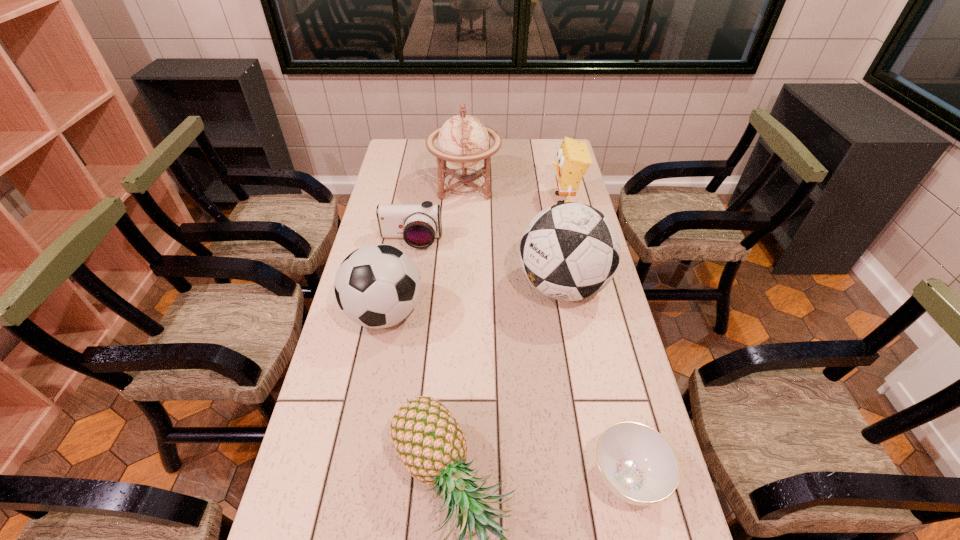
What are the coordinates of `soccer ball that is at the right edge` in the screenshot? It's located at (570, 251).

Identify the location of sponge positioned at the right edge. This screenshot has height=540, width=960. (573, 159).

Locate an element on the screen. chinaware that is at the right edge is located at coordinates (637, 464).

In the image, there is a desktop. Where is `free space at the far edge`? This screenshot has height=540, width=960. free space at the far edge is located at coordinates (500, 153).

The image size is (960, 540). Find the location of `free space at the left edge of the desktop`. free space at the left edge of the desktop is located at coordinates (310, 479).

At what (x,y) coordinates should I click in order to perform the action: click on free region at the right edge of the desktop. Please return your answer as a coordinate pair (x, y). The width and height of the screenshot is (960, 540). Looking at the image, I should click on (590, 354).

At what (x,y) coordinates should I click in order to perform the action: click on free region at the far left corner. Please return your answer as a coordinate pair (x, y). Image resolution: width=960 pixels, height=540 pixels. Looking at the image, I should click on (402, 140).

In the image, there is a desktop. Identify the location of free space at the far right corner. The height and width of the screenshot is (540, 960). (544, 157).

Locate an element on the screen. This screenshot has width=960, height=540. vacant region between the shortest object and the globe is located at coordinates (546, 332).

Locate an element on the screen. The image size is (960, 540). empty location between the sixth tallest object and the sponge is located at coordinates (488, 220).